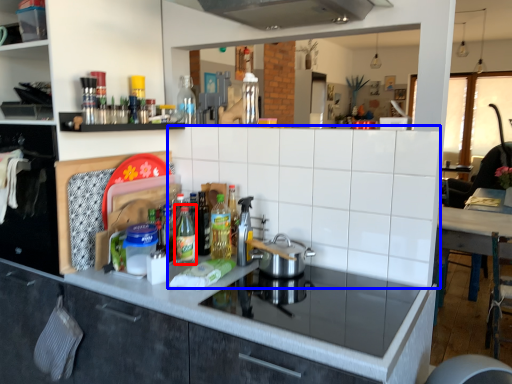
Question: Which object is further to the camera taking this photo, bottle (highlighted by a red box) or tile (highlighted by a blue box)?

Choices:
 (A) bottle
 (B) tile

Answer: (A)